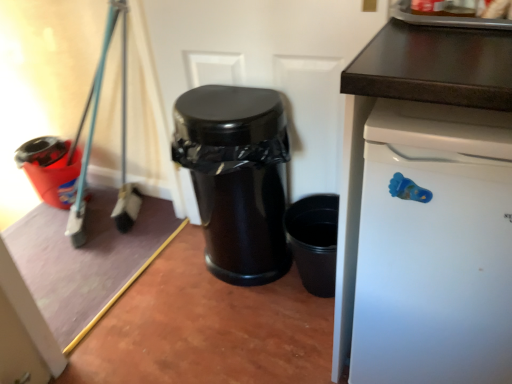
Identify the location of vacant space in front of matte plastic bucket at left, the first waste container when ordered from back to front. This screenshot has height=384, width=512. (53, 233).